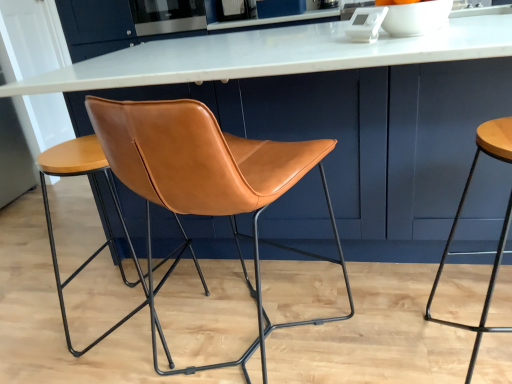
This screenshot has height=384, width=512. What are the coordinates of `free point below saddle brown leather chair at center (from a real-world perspective)` in the screenshot? It's located at (260, 355).